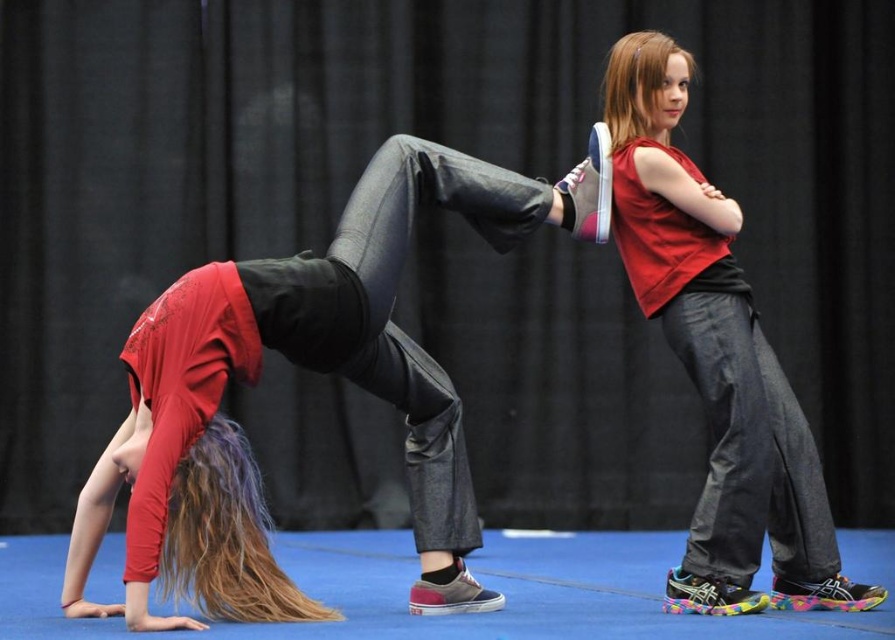
You are a photographer setting up a camera 2 meters away from the performers. You need to capture both the matte black leggings at center and the matte red tank top at center in the same frame. The camera has a focal length of 50mm. Given that the minimum distance between objects in the frame should be at least 0.5 meters to avoid blurriness, will the current setup work?

The distance between the matte black leggings at center and the matte red tank top at center is 1.39 meters. Since 1.39 meters is greater than the required minimum 0.5 meters, the current camera setup with a 50mm focal length at 2 meters away will successfully capture both objects in focus without blurriness.

In the scene shown: You are a costume designer preparing for a performance. You need to ensure that the costume pieces are proportional. Given the scene, which object is wider between the matte black leggings at center and the matte red tank top at center?

The matte black leggings at center is wider than the matte red tank top at center according to the description provided.